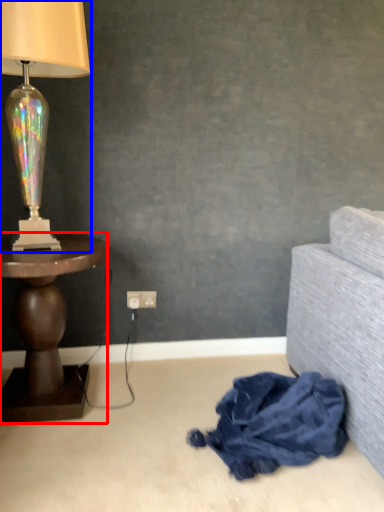
Question: Which object appears farthest to the camera in this image, table (highlighted by a red box) or lamp (highlighted by a blue box)?

Choices:
 (A) table
 (B) lamp

Answer: (A)